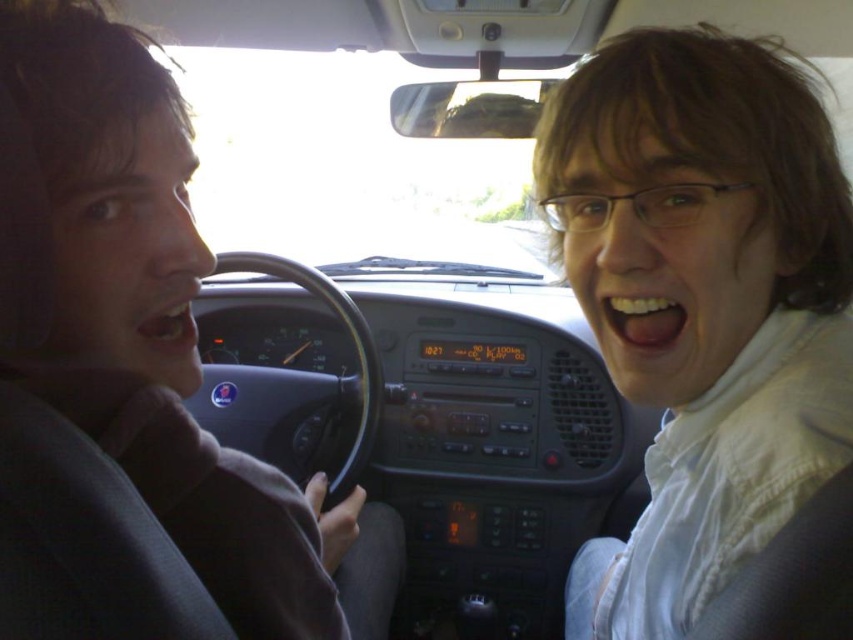
Question: Does white matte jacket at center appear on the left side of matte gray shirt at left?

Choices:
 (A) yes
 (B) no

Answer: (B)

Question: Observing the image, what is the correct spatial positioning of white matte jacket at center in reference to matte gray shirt at left?

Choices:
 (A) above
 (B) below

Answer: (B)

Question: Which point is closer to the camera?

Choices:
 (A) click(71, 324)
 (B) click(560, 161)

Answer: (A)

Question: Can you confirm if white matte jacket at center is wider than matte gray shirt at left?

Choices:
 (A) no
 (B) yes

Answer: (B)

Question: Which of the following is the closest to the observer?

Choices:
 (A) white matte jacket at center
 (B) matte gray shirt at left

Answer: (B)